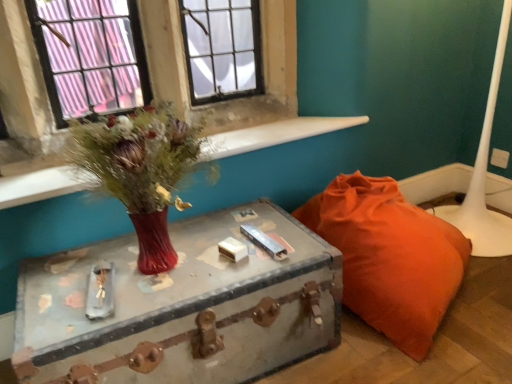
Question: Can you confirm if rusty metal trunk at center is wider than orange fabric bean bag at lower right?

Choices:
 (A) no
 (B) yes

Answer: (A)

Question: Does rusty metal trunk at center lie in front of orange fabric bean bag at lower right?

Choices:
 (A) yes
 (B) no

Answer: (A)

Question: Is rusty metal trunk at center further to camera compared to orange fabric bean bag at lower right?

Choices:
 (A) yes
 (B) no

Answer: (B)

Question: From a real-world perspective, does rusty metal trunk at center sit lower than orange fabric bean bag at lower right?

Choices:
 (A) no
 (B) yes

Answer: (B)

Question: Does rusty metal trunk at center have a larger size compared to orange fabric bean bag at lower right?

Choices:
 (A) no
 (B) yes

Answer: (A)

Question: From the image's perspective, relative to white glossy table lamp at lower right, is orange fabric bean bag at lower right above or below?

Choices:
 (A) above
 (B) below

Answer: (B)

Question: Which is correct: orange fabric bean bag at lower right is inside white glossy table lamp at lower right, or outside of it?

Choices:
 (A) outside
 (B) inside

Answer: (A)

Question: Considering the positions of orange fabric bean bag at lower right and white glossy table lamp at lower right in the image, is orange fabric bean bag at lower right taller or shorter than white glossy table lamp at lower right?

Choices:
 (A) tall
 (B) short

Answer: (B)

Question: From a real-world perspective, relative to white glossy table lamp at lower right, is orange fabric bean bag at lower right vertically above or below?

Choices:
 (A) above
 (B) below

Answer: (B)

Question: Considering the positions of rusty metal trunk at center and orange fabric bean bag at lower right in the image, is rusty metal trunk at center bigger or smaller than orange fabric bean bag at lower right?

Choices:
 (A) small
 (B) big

Answer: (A)

Question: Is point (169, 297) positioned closer to the camera than point (371, 322)?

Choices:
 (A) closer
 (B) farther

Answer: (A)

Question: From the image's perspective, is rusty metal trunk at center located above or below orange fabric bean bag at lower right?

Choices:
 (A) above
 (B) below

Answer: (B)

Question: Considering the positions of rusty metal trunk at center and orange fabric bean bag at lower right in the image, is rusty metal trunk at center wider or thinner than orange fabric bean bag at lower right?

Choices:
 (A) thin
 (B) wide

Answer: (A)

Question: In terms of height, does matte red vase at upper left look taller or shorter compared to matte glass vase at upper left?

Choices:
 (A) short
 (B) tall

Answer: (B)

Question: Based on their sizes in the image, would you say matte red vase at upper left is bigger or smaller than matte glass vase at upper left?

Choices:
 (A) big
 (B) small

Answer: (A)